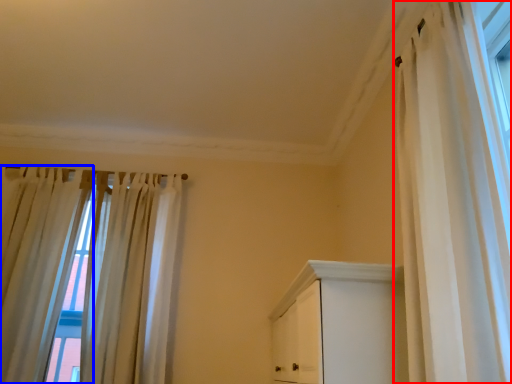
Question: Which of the following is the closest to the observer, curtain (highlighted by a red box) or curtain (highlighted by a blue box)?

Choices:
 (A) curtain
 (B) curtain

Answer: (A)